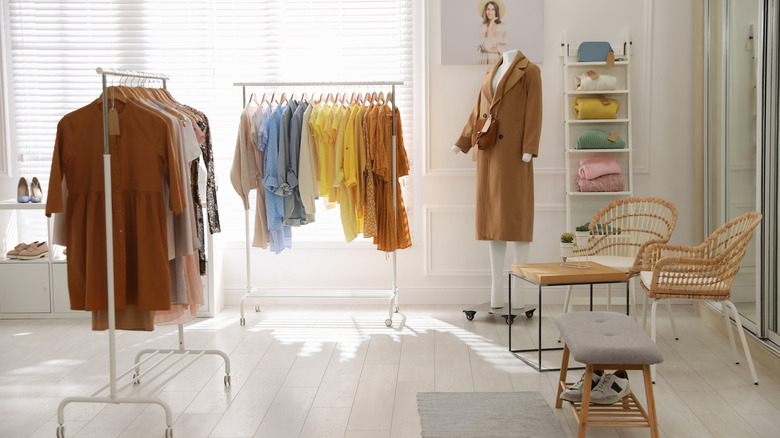
Find the location of a particular element. surface you can sit on is located at coordinates (619, 256), (658, 271), (614, 330), (339, 376).